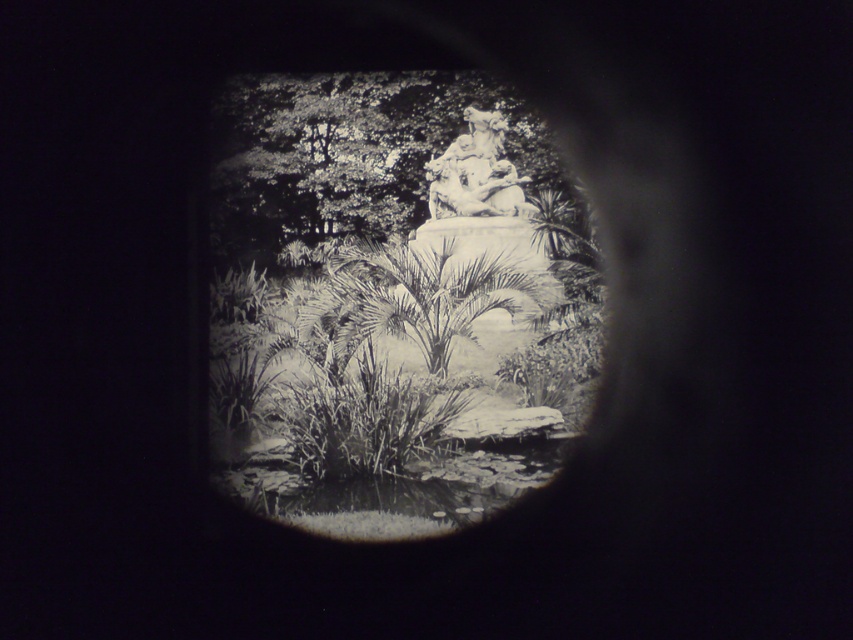
Question: Which point appears farthest from the camera in this image?

Choices:
 (A) (460, 193)
 (B) (492, 120)

Answer: (B)

Question: Can you confirm if smooth stone statue at center is bigger than white marble statue at center?

Choices:
 (A) no
 (B) yes

Answer: (A)

Question: Which point appears farthest from the camera in this image?

Choices:
 (A) (436, 124)
 (B) (465, 168)

Answer: (A)

Question: Does smooth stone statue at center appear on the right side of white marble statue at center?

Choices:
 (A) yes
 (B) no

Answer: (B)

Question: Is smooth stone statue at center in front of white marble statue at center?

Choices:
 (A) no
 (B) yes

Answer: (A)